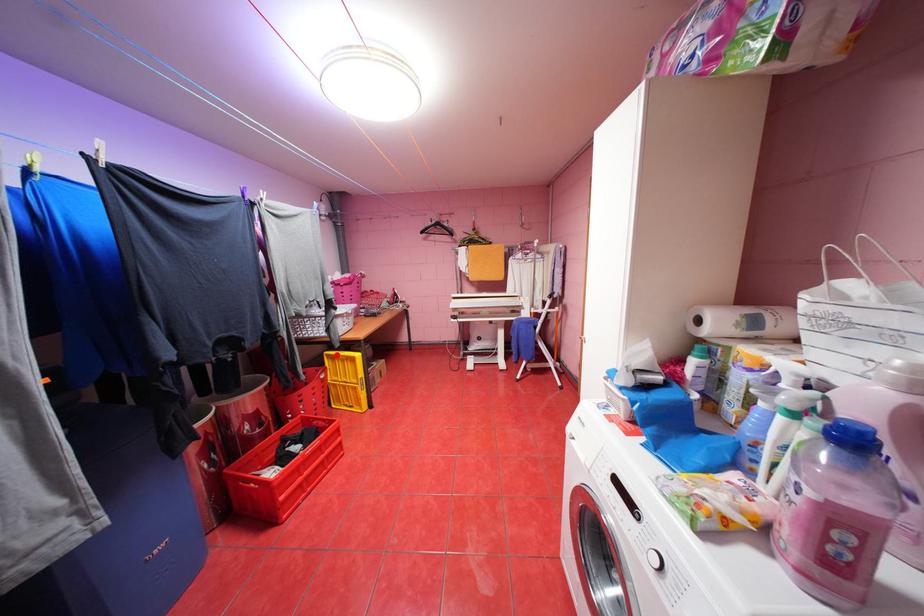
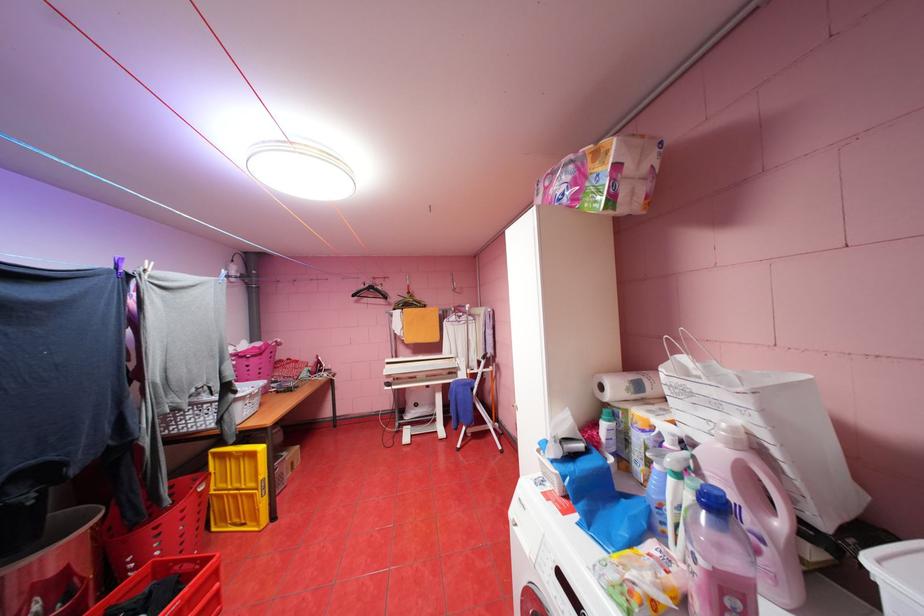
The point at the highlighted location is marked in the first image. Where is the corresponding point in the second image?

(224, 454)